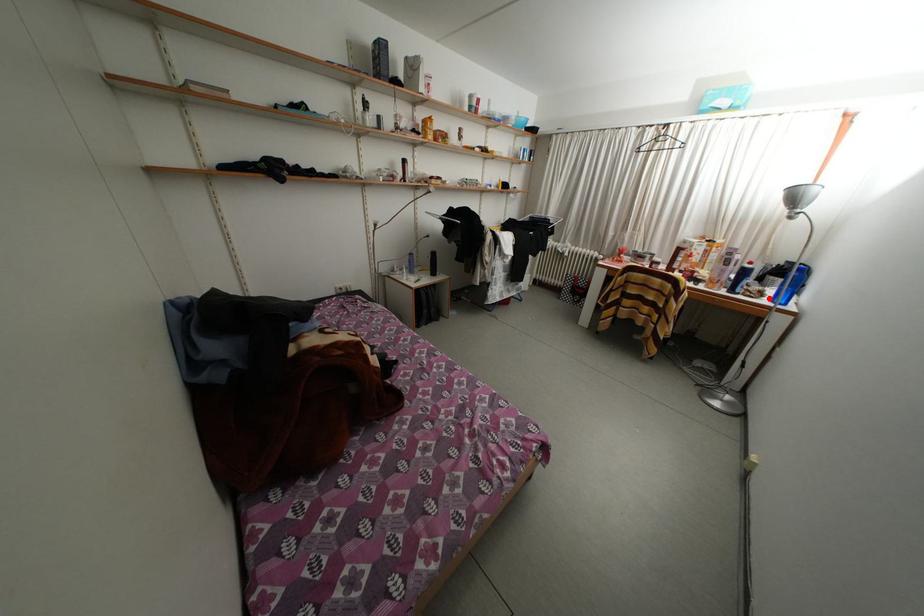
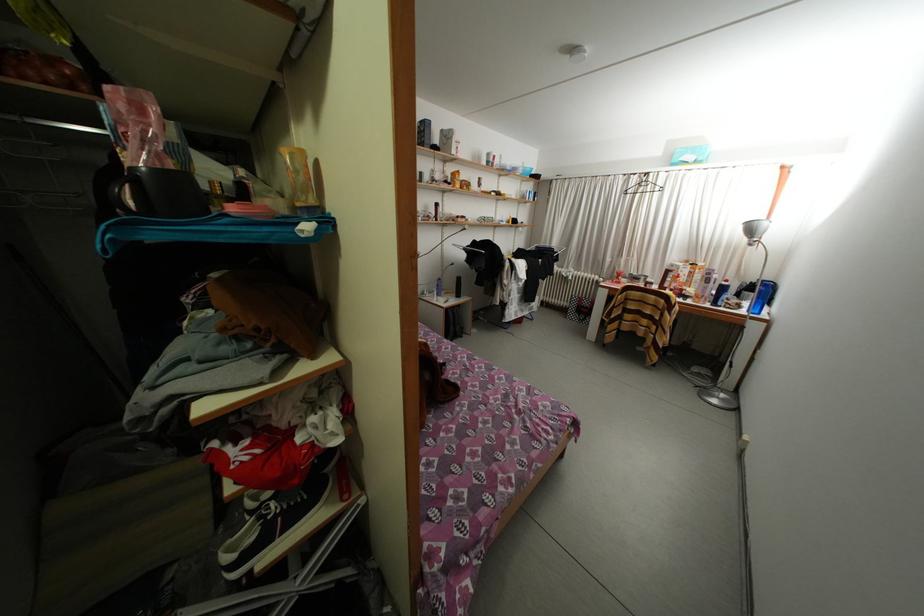
The point at the highlighted location is marked in the first image. Where is the corresponding point in the second image?

(747, 310)